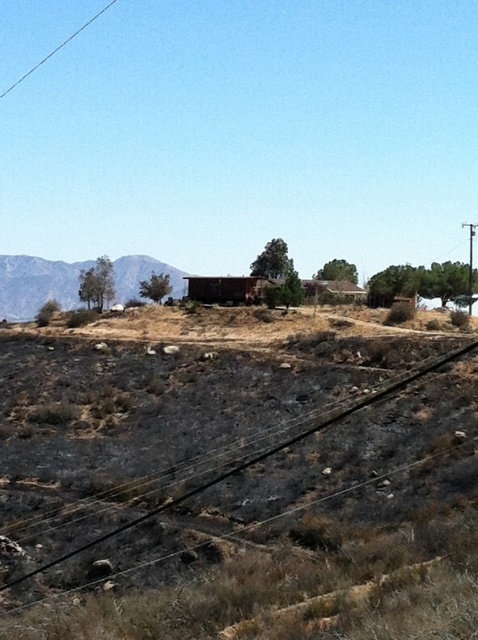
Question: Is rugged brown mountain at left wider than smooth wood telegraph pole at right?

Choices:
 (A) yes
 (B) no

Answer: (A)

Question: Can you confirm if rugged brown mountain at left is positioned to the left of smooth wood telegraph pole at right?

Choices:
 (A) no
 (B) yes

Answer: (B)

Question: Among these objects, which one is farthest from the camera?

Choices:
 (A) black asphalt train track at lower center
 (B) rugged brown mountain at left
 (C) smooth wood telegraph pole at right

Answer: (B)

Question: Which is nearer to the rugged brown mountain at left?

Choices:
 (A) smooth wood telegraph pole at right
 (B) black asphalt train track at lower center

Answer: (B)

Question: Is rugged brown mountain at left wider than smooth wood telegraph pole at right?

Choices:
 (A) no
 (B) yes

Answer: (B)

Question: Which is nearer to the smooth wood telegraph pole at right?

Choices:
 (A) rugged brown mountain at left
 (B) black asphalt train track at lower center

Answer: (B)